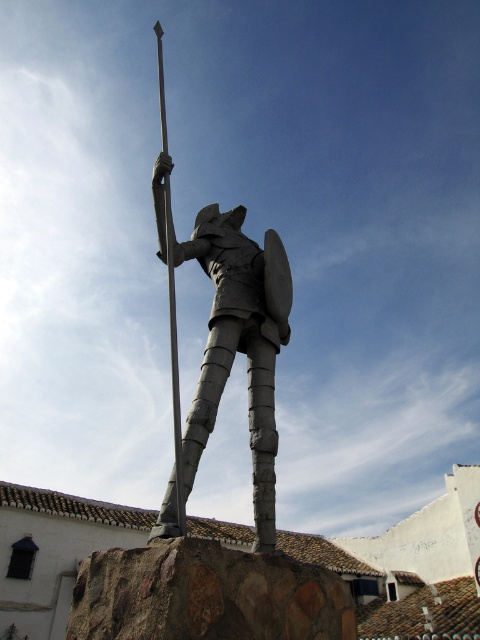
Question: Is gray stone warrior at center thinner than polished metal pole at center?

Choices:
 (A) yes
 (B) no

Answer: (A)

Question: Can you confirm if gray stone warrior at center is bigger than polished metal pole at center?

Choices:
 (A) no
 (B) yes

Answer: (A)

Question: Which object appears farthest from the camera in this image?

Choices:
 (A) polished metal pole at center
 (B) gray stone warrior at center

Answer: (A)

Question: Does gray stone warrior at center have a smaller size compared to polished metal pole at center?

Choices:
 (A) no
 (B) yes

Answer: (B)